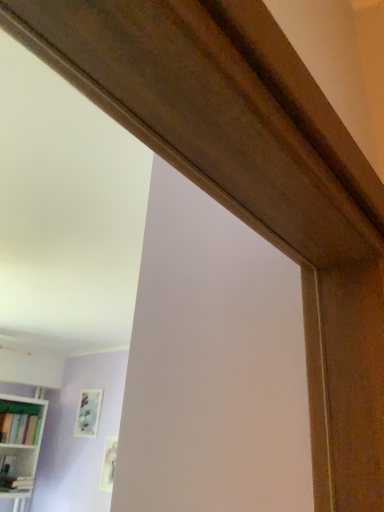
Question: Is matte white picture frame at lower center, which is the second picture frame from back to front, turned away from matte wooden picture frame at upper left, the 1th picture frame viewed from the left?

Choices:
 (A) no
 (B) yes

Answer: (A)

Question: Does matte white picture frame at lower center, the 1th picture frame in the right-to-left sequence, have a lesser width compared to matte wooden picture frame at upper left, acting as the first picture frame starting from the back?

Choices:
 (A) yes
 (B) no

Answer: (A)

Question: Can we say matte white picture frame at lower center, which is the second picture frame from back to front, lies outside matte wooden picture frame at upper left, the second picture frame in the front-to-back sequence?

Choices:
 (A) no
 (B) yes

Answer: (B)

Question: From a real-world perspective, is matte white picture frame at lower center, which ranks as the first picture frame in front-to-back order, located higher than matte wooden picture frame at upper left, acting as the first picture frame starting from the back?

Choices:
 (A) yes
 (B) no

Answer: (B)

Question: Does matte white picture frame at lower center, which is the second picture frame from back to front, have a larger size compared to matte wooden picture frame at upper left, the 1th picture frame viewed from the left?

Choices:
 (A) no
 (B) yes

Answer: (A)

Question: Is there a large distance between matte white picture frame at lower center, the second picture frame in the left-to-right sequence, and matte wooden picture frame at upper left, the second picture frame in the front-to-back sequence?

Choices:
 (A) no
 (B) yes

Answer: (A)

Question: From the image's perspective, is matte wooden picture frame at upper left, the 1th picture frame viewed from the left, on white glossy bookcase at lower left?

Choices:
 (A) yes
 (B) no

Answer: (A)

Question: Is there a large distance between matte wooden picture frame at upper left, the second picture frame in the front-to-back sequence, and white glossy bookcase at lower left?

Choices:
 (A) no
 (B) yes

Answer: (A)

Question: Considering the relative sizes of matte wooden picture frame at upper left, the 1th picture frame viewed from the left, and white glossy bookcase at lower left in the image provided, is matte wooden picture frame at upper left, the 1th picture frame viewed from the left, bigger than white glossy bookcase at lower left?

Choices:
 (A) yes
 (B) no

Answer: (B)

Question: From a real-world perspective, does matte wooden picture frame at upper left, acting as the 2th picture frame starting from the right, sit lower than white glossy bookcase at lower left?

Choices:
 (A) no
 (B) yes

Answer: (A)

Question: From a real-world perspective, is matte wooden picture frame at upper left, the 1th picture frame viewed from the left, physically above white glossy bookcase at lower left?

Choices:
 (A) no
 (B) yes

Answer: (B)

Question: Is matte wooden picture frame at upper left, the 1th picture frame viewed from the left, touching white glossy bookcase at lower left?

Choices:
 (A) no
 (B) yes

Answer: (A)

Question: Is white glossy bookcase at lower left shorter than matte white picture frame at lower center, which is the second picture frame from back to front?

Choices:
 (A) no
 (B) yes

Answer: (A)